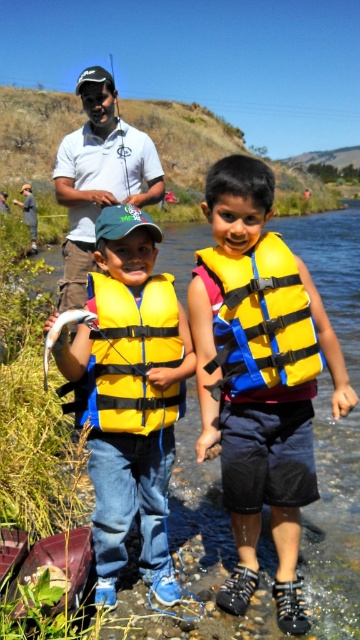
Question: Which point is closer to the camera?

Choices:
 (A) yellow/blue fabric life jacket at center
 (B) matte white polo shirt at upper center
 (C) yellow matte life vest at center

Answer: (C)

Question: Which object appears closest to the camera in this image?

Choices:
 (A) yellow matte life vest at center
 (B) yellow matte life jacket at center
 (C) matte white polo shirt at upper center

Answer: (A)

Question: Is yellow life vest at center wider than yellow matte life jacket at center?

Choices:
 (A) yes
 (B) no

Answer: (A)

Question: Can you confirm if yellow life vest at center is bigger than yellow matte life jacket at center?

Choices:
 (A) no
 (B) yes

Answer: (B)

Question: Can you confirm if yellow life vest at center is bigger than yellow matte life jacket at center?

Choices:
 (A) no
 (B) yes

Answer: (B)

Question: Based on their relative distances, which object is nearer to the yellow life vest at center?

Choices:
 (A) matte white polo shirt at upper center
 (B) yellow matte life jacket at center
 (C) yellow/blue fabric life jacket at center

Answer: (C)